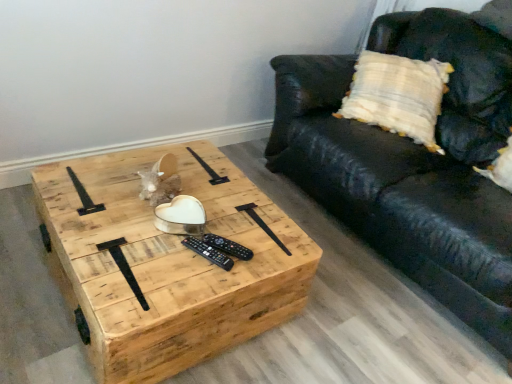
Question: Can you confirm if black leather couch at center is taller than natural wood coffee table at center?

Choices:
 (A) yes
 (B) no

Answer: (A)

Question: From the image's perspective, is black leather couch at center beneath natural wood coffee table at center?

Choices:
 (A) no
 (B) yes

Answer: (A)

Question: From a real-world perspective, is black leather couch at center positioned over natural wood coffee table at center based on gravity?

Choices:
 (A) yes
 (B) no

Answer: (A)

Question: Can you confirm if black leather couch at center is wider than natural wood coffee table at center?

Choices:
 (A) yes
 (B) no

Answer: (A)

Question: From a real-world perspective, is black leather couch at center physically below natural wood coffee table at center?

Choices:
 (A) no
 (B) yes

Answer: (A)

Question: Based on their sizes in the image, would you say natural wood coffee table at center is bigger or smaller than black plastic remote at center, the 1th remote viewed from the front?

Choices:
 (A) small
 (B) big

Answer: (B)

Question: Relative to black plastic remote at center, the 1th remote viewed from the front, is natural wood coffee table at center in front or behind?

Choices:
 (A) behind
 (B) front

Answer: (B)

Question: Is point (223, 337) positioned closer to the camera than point (204, 248)?

Choices:
 (A) farther
 (B) closer

Answer: (A)

Question: Considering the positions of natural wood coffee table at center and black plastic remote at center, the 2th remote in the back-to-front sequence, in the image, is natural wood coffee table at center taller or shorter than black plastic remote at center, the 2th remote in the back-to-front sequence,?

Choices:
 (A) short
 (B) tall

Answer: (B)

Question: Do you think black plastic remote at center, the 2th remote in the back-to-front sequence, is within black leather couch at center, or outside of it?

Choices:
 (A) inside
 (B) outside

Answer: (B)

Question: From their relative heights in the image, would you say black plastic remote at center, the 2th remote in the back-to-front sequence, is taller or shorter than black leather couch at center?

Choices:
 (A) short
 (B) tall

Answer: (A)

Question: Based on their sizes in the image, would you say black plastic remote at center, the 1th remote viewed from the front, is bigger or smaller than black leather couch at center?

Choices:
 (A) big
 (B) small

Answer: (B)

Question: Looking at their shapes, would you say black plastic remote at center, the 2th remote in the back-to-front sequence, is wider or thinner than black leather couch at center?

Choices:
 (A) thin
 (B) wide

Answer: (A)

Question: From a real-world perspective, is black leather couch at center physically located above or below black plastic remote at center, the 2th remote when ordered from front to back?

Choices:
 (A) below
 (B) above

Answer: (B)

Question: From their relative heights in the image, would you say black leather couch at center is taller or shorter than black plastic remote at center, which is the 1th remote from back to front?

Choices:
 (A) short
 (B) tall

Answer: (B)